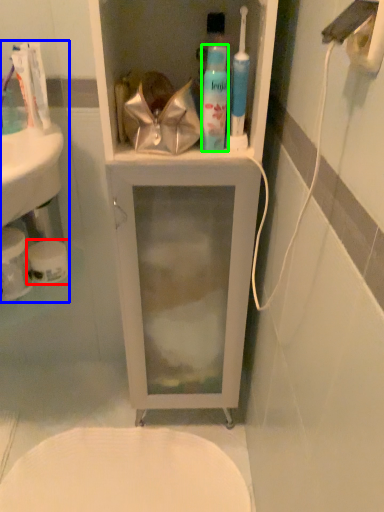
Question: Considering the real-world distances, which object is farthest from toilet paper (highlighted by a red box)? sink (highlighted by a blue box) or mouthwash (highlighted by a green box)?

Choices:
 (A) sink
 (B) mouthwash

Answer: (B)